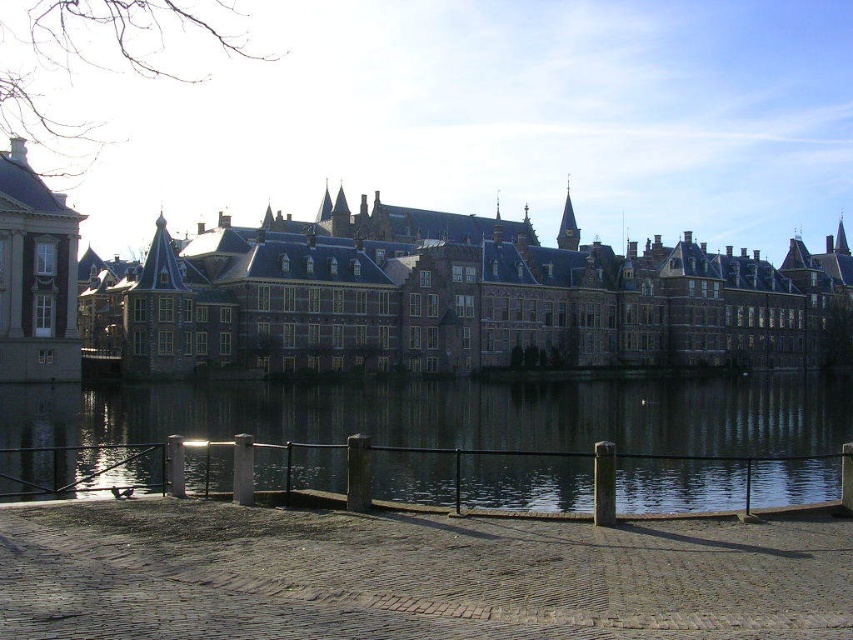
You are standing on a bridge overlooking the historic buildings and water. You see the brown brick castle at center and the dark reflective water at center. Which object is positioned to the right side from your viewpoint?

The brown brick castle at center is to the right of the dark reflective water at center, so the brown brick castle at center is positioned to the right side from your viewpoint.

You are a tourist standing on the bank of the canal and want to take a photo of the brown brick castle at center and the dark reflective water at center. Which object should you focus on first if you want to capture both in a single frame without moving the camera?

You should focus on the brown brick castle at center first because it is taller than the dark reflective water at center, allowing you to frame it properly while still including the water in the shot.